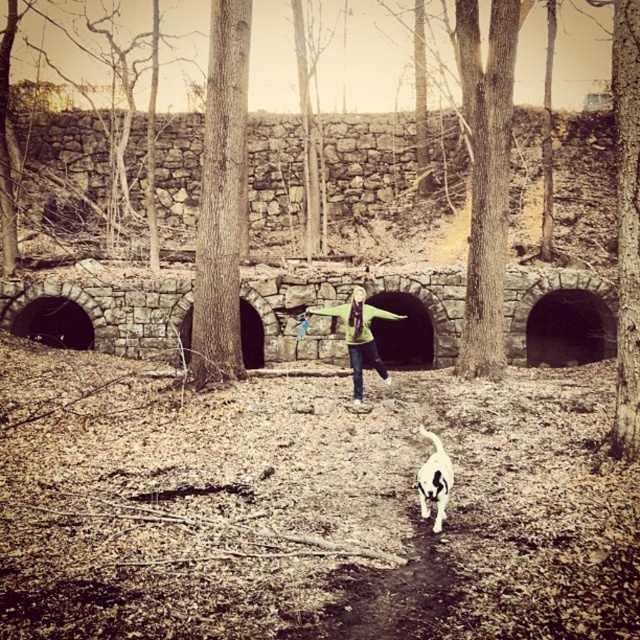
Is green fleece jacket at center positioned at the back of white fur dog at center?

Yes, it is behind white fur dog at center.

Who is more distant from viewer, [349,304] or [438,497]?

Point [349,304]

Is point (340, 310) farther from viewer compared to point (448, 492)?

That is True.

This screenshot has width=640, height=640. Find the location of `green fleece jacket at center`. green fleece jacket at center is located at coordinates tap(358, 336).